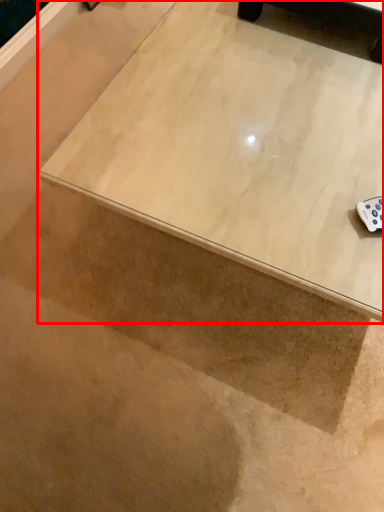
Question: Where is table (annotated by the red box) located in relation to furniture in the image?

Choices:
 (A) left
 (B) right

Answer: (B)